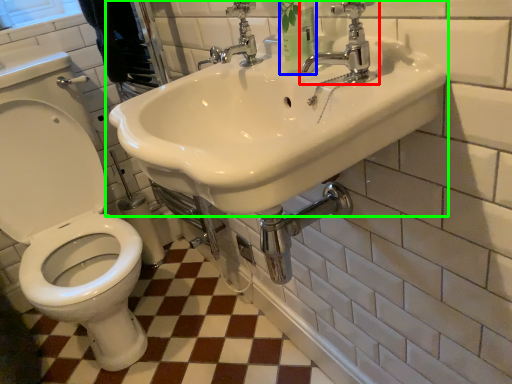
Question: Which is nearer to the tap (highlighted by a red box)? toiletry (highlighted by a blue box) or sink (highlighted by a green box).

Choices:
 (A) toiletry
 (B) sink

Answer: (A)